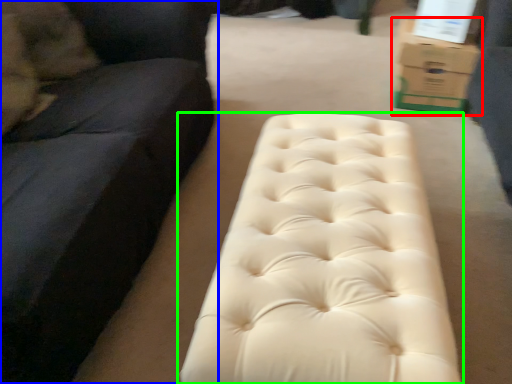
Question: Which object is the closest to the cardboard box (highlighted by a red box)? Choose among these: studio couch (highlighted by a blue box) or furniture (highlighted by a green box).

Choices:
 (A) studio couch
 (B) furniture

Answer: (B)